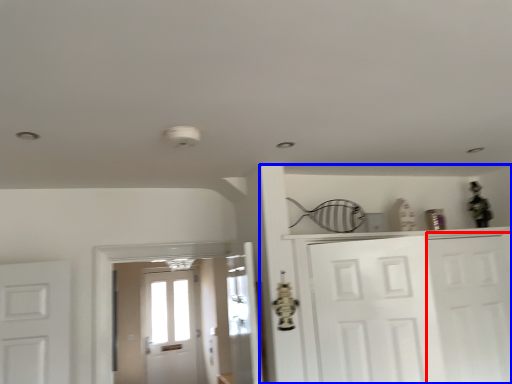
Question: Which object appears farthest to the camera in this image, door (highlighted by a red box) or dresser (highlighted by a blue box)?

Choices:
 (A) door
 (B) dresser

Answer: (A)